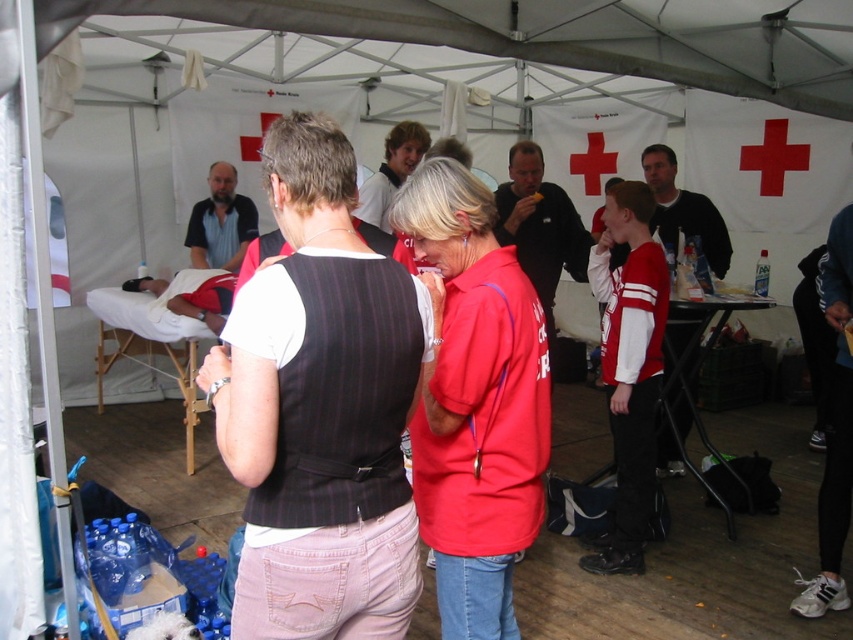
You are a photographer setting up a shoot inside the tent. You need to ensure that the dark brown hair at center and the smooth white shirt at center are both visible in the frame. Given their sizes, which object should you focus on to ensure both are in focus?

The dark brown hair at center is larger in size than the smooth white shirt at center. To ensure both are in focus, you should focus on the larger object, which is the dark brown hair at center.

You are a photographer standing outside the tent and want to take a photo of the dark gray sweater at center and the dark brown hair at center. Based on their positions, can you see both subjects clearly in the same frame without moving the camera?

The dark gray sweater at center is positioned under dark brown hair at center, so the dark gray sweater at center may be partially or fully obscured by the dark brown hair at center in the photo. Therefore, you might not be able to see both clearly in the same frame without moving the camera.